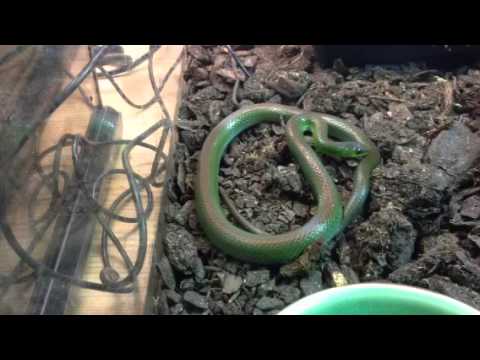
In order to click on top part of green bowl in this screenshot , I will do `click(389, 302)`.